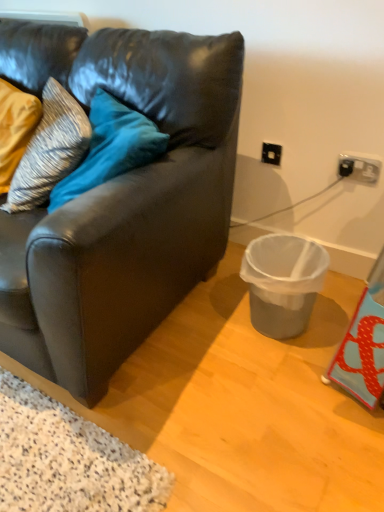
This screenshot has height=512, width=384. In order to click on vacant area that is in front of gray plastic trash can at lower right in this screenshot , I will do `click(284, 375)`.